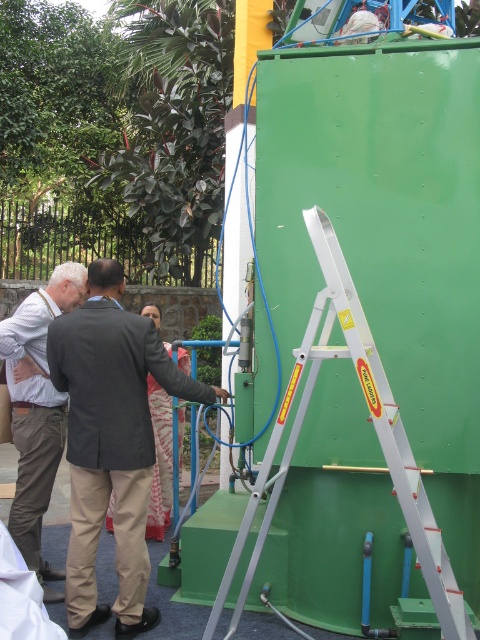
From the picture: You are standing at the position of point (255, 547) and want to move to the position of point (64, 387). Is the path directly in front of you blocked by the large green industrial machine?

Point (64, 387) is behind point (255, 547), so the path directly in front of you is blocked by the large green industrial machine.